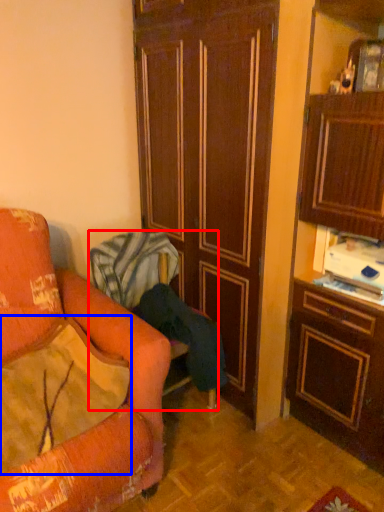
Question: Among these objects, which one is nearest to the camera, chair (highlighted by a red box) or pillow (highlighted by a blue box)?

Choices:
 (A) chair
 (B) pillow

Answer: (B)